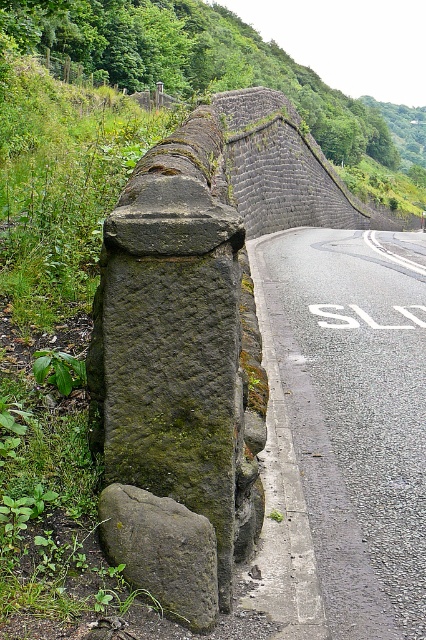
Question: Is green mossy stone wall at upper center closer to the viewer compared to green mossy rock at left?

Choices:
 (A) no
 (B) yes

Answer: (A)

Question: Can you confirm if asphalt road at center is thinner than gray concrete curb at lower center?

Choices:
 (A) no
 (B) yes

Answer: (A)

Question: Based on their relative distances, which object is farther from the gray concrete curb at lower center?

Choices:
 (A) asphalt road at center
 (B) green mossy rock at left
 (C) green mossy stone wall at upper center

Answer: (C)

Question: Can you confirm if green mossy stone wall at upper center is thinner than gray concrete curb at lower center?

Choices:
 (A) yes
 (B) no

Answer: (B)

Question: Which is nearer to the asphalt road at center?

Choices:
 (A) green mossy rock at left
 (B) gray concrete curb at lower center
 (C) green mossy stone wall at upper center

Answer: (A)

Question: Which object is positioned farthest from the green mossy rock at left?

Choices:
 (A) gray concrete curb at lower center
 (B) green mossy stone wall at upper center

Answer: (B)